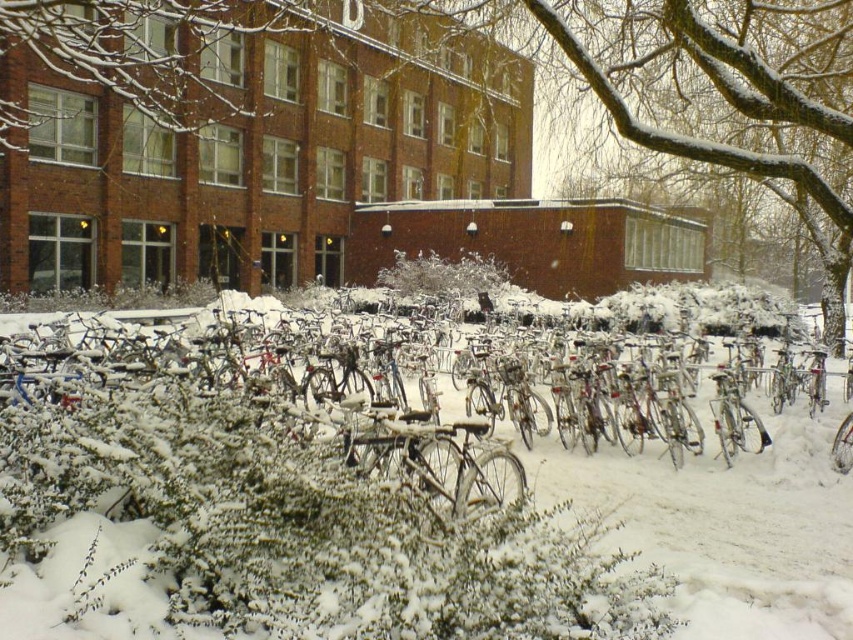
Which of these two, metallic silver bicycle at center or white fluffy bush at center, stands shorter?

white fluffy bush at center

Is metallic silver bicycle at center shorter than white fluffy bush at center?

No.

Describe the element at coordinates (712, 472) in the screenshot. I see `metallic silver bicycle at center` at that location.

Identify the location of metallic silver bicycle at center. Image resolution: width=853 pixels, height=640 pixels. (712, 472).